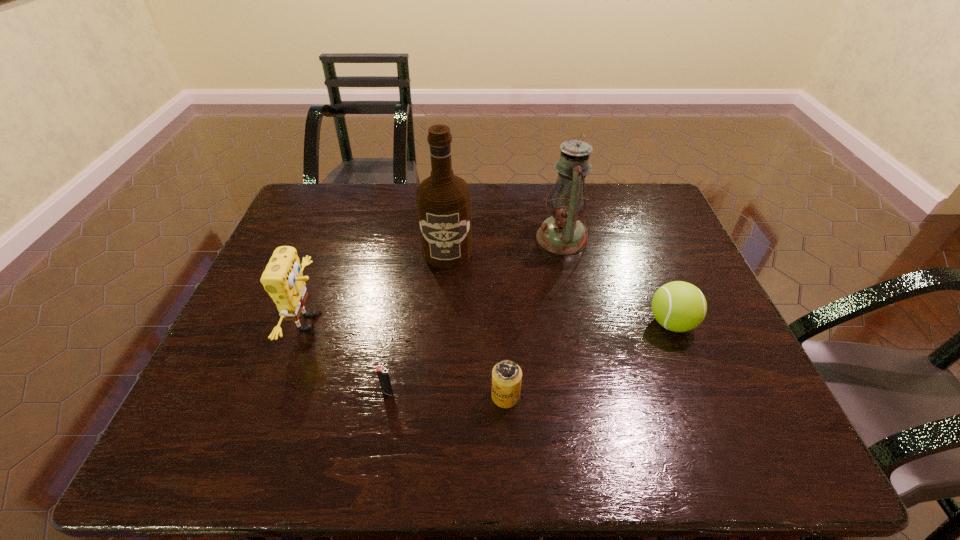
Where is `empty space that is in between the rightmost object and the fourth object from right to left`? This screenshot has height=540, width=960. empty space that is in between the rightmost object and the fourth object from right to left is located at coordinates (560, 287).

This screenshot has height=540, width=960. I want to click on vacant region between the shortest object and the beer can, so click(x=446, y=394).

Find the location of a particular element. vacant space that is in between the sponge and the fifth object from right to left is located at coordinates (348, 357).

Identify the location of the second closest object to the fourth shortest object. The height and width of the screenshot is (540, 960). (443, 200).

At what (x,y) coordinates should I click in order to perform the action: click on object that is the closest one to the rightmost object. Please return your answer as a coordinate pair (x, y). Image resolution: width=960 pixels, height=540 pixels. Looking at the image, I should click on (562, 233).

The width and height of the screenshot is (960, 540). Identify the location of vacant space that satisfies the following two spatial constraints: 1. on the label of the alcohol; 2. on the right side of the third object from right to left. (436, 396).

Image resolution: width=960 pixels, height=540 pixels. Find the location of `free location that satisfies the following two spatial constraints: 1. on the label of the fourth object from right to left; 2. on the right side of the tennis ball`. free location that satisfies the following two spatial constraints: 1. on the label of the fourth object from right to left; 2. on the right side of the tennis ball is located at coordinates (442, 323).

Image resolution: width=960 pixels, height=540 pixels. What are the coordinates of `vacant region that satisfies the following two spatial constraints: 1. on the face of the fourth shortest object; 2. on the back side of the fifth object from right to left` in the screenshot? It's located at (283, 392).

Find the location of a particular element. The height and width of the screenshot is (540, 960). vacant area that satisfies the following two spatial constraints: 1. on the back side of the tennis ball; 2. on the right side of the third object from right to left is located at coordinates (502, 323).

Where is `vacant space that satisfies the following two spatial constraints: 1. on the face of the fifth object from right to left; 2. on the left side of the fourth shortest object`? The height and width of the screenshot is (540, 960). vacant space that satisfies the following two spatial constraints: 1. on the face of the fifth object from right to left; 2. on the left side of the fourth shortest object is located at coordinates (283, 392).